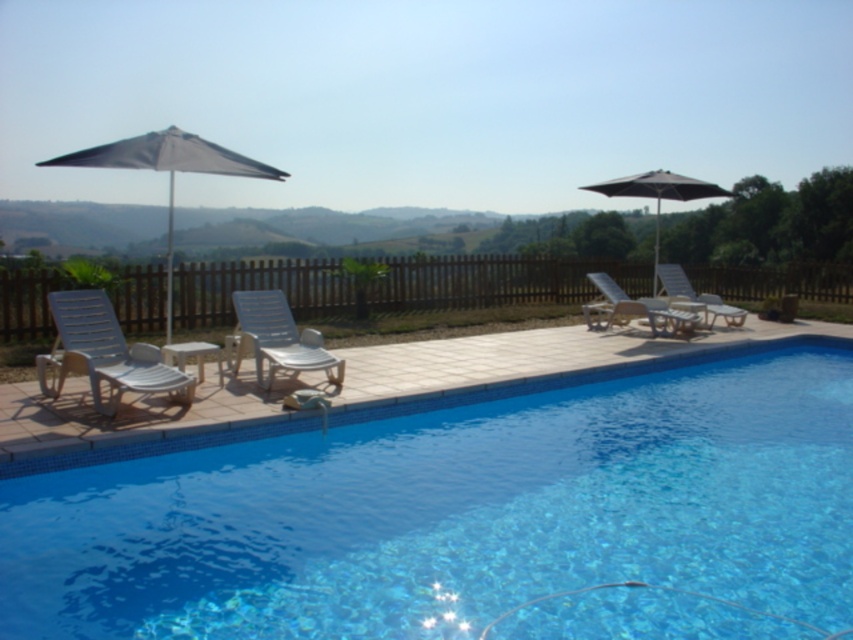
Question: Observing the image, what is the correct spatial positioning of metallic silver lounge chair at right in reference to matte black umbrella at upper right?

Choices:
 (A) left
 (B) right

Answer: (A)

Question: Is the position of transparent glass pool at center less distant than that of metallic silver lounge chair at right?

Choices:
 (A) yes
 (B) no

Answer: (A)

Question: Which point appears farthest from the camera in this image?

Choices:
 (A) (199, 172)
 (B) (265, 339)
 (C) (610, 312)
 (D) (271, 582)

Answer: (C)

Question: Which of the following is the closest to the observer?

Choices:
 (A) metallic silver lounge chair at right
 (B) white plastic lounge chair at center right
 (C) dark gray fabric umbrella at left
 (D) white plastic lounge chair at left

Answer: (D)

Question: Is white plastic lounge chair at left positioned before dark gray fabric umbrella at left?

Choices:
 (A) no
 (B) yes

Answer: (B)

Question: Which of the following is the farthest from the observer?

Choices:
 (A) white plastic lounge chair at left
 (B) matte black umbrella at upper right
 (C) transparent glass pool at center
 (D) dark gray fabric umbrella at left

Answer: (B)